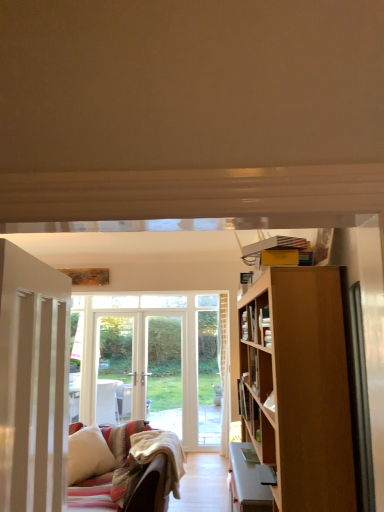
Question: Can you confirm if white soft pillow at lower left is bigger than hardcover book at center?

Choices:
 (A) no
 (B) yes

Answer: (B)

Question: From a real-world perspective, is white soft pillow at lower left beneath hardcover book at center?

Choices:
 (A) no
 (B) yes

Answer: (B)

Question: From the image's perspective, is white soft pillow at lower left on top of hardcover book at center?

Choices:
 (A) no
 (B) yes

Answer: (A)

Question: Does white soft pillow at lower left contain hardcover book at center?

Choices:
 (A) yes
 (B) no

Answer: (B)

Question: Does white soft pillow at lower left have a smaller size compared to hardcover book at center?

Choices:
 (A) no
 (B) yes

Answer: (A)

Question: From a real-world perspective, is white wooden door at left above or below white soft pillow at lower left?

Choices:
 (A) below
 (B) above

Answer: (B)

Question: From the image's perspective, is white wooden door at left above or below white soft pillow at lower left?

Choices:
 (A) above
 (B) below

Answer: (A)

Question: Based on their sizes in the image, would you say white wooden door at left is bigger or smaller than white soft pillow at lower left?

Choices:
 (A) small
 (B) big

Answer: (A)

Question: Is point (36, 306) positioned closer to the camera than point (104, 473)?

Choices:
 (A) closer
 (B) farther

Answer: (A)

Question: Considering the positions of hardcover book at center and white soft pillow at lower left in the image, is hardcover book at center bigger or smaller than white soft pillow at lower left?

Choices:
 (A) big
 (B) small

Answer: (B)

Question: Choose the correct answer: Is hardcover book at center inside white soft pillow at lower left or outside it?

Choices:
 (A) outside
 (B) inside

Answer: (A)

Question: Would you say hardcover book at center is to the left or to the right of white soft pillow at lower left in the picture?

Choices:
 (A) left
 (B) right

Answer: (B)

Question: Considering their positions, is hardcover book at center located in front of or behind white soft pillow at lower left?

Choices:
 (A) front
 (B) behind

Answer: (A)

Question: In terms of width, does white wooden door at left look wider or thinner when compared to hardcover book at center?

Choices:
 (A) wide
 (B) thin

Answer: (A)

Question: Is point pos(61,501) closer or farther from the camera than point pos(246,388)?

Choices:
 (A) closer
 (B) farther

Answer: (A)